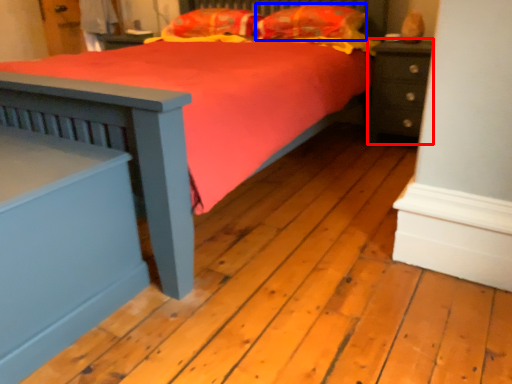
Question: Among these objects, which one is farthest to the camera, nightstand (highlighted by a red box) or pillow (highlighted by a blue box)?

Choices:
 (A) nightstand
 (B) pillow

Answer: (B)